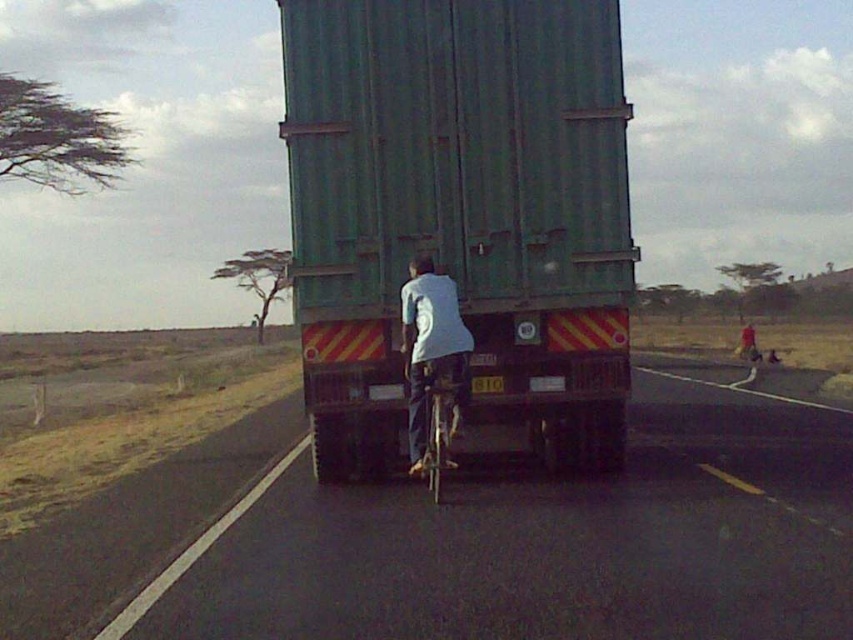
Who is shorter, green matte trailer truck at center or white matte shirt at center?

white matte shirt at center

Can you confirm if green matte trailer truck at center is wider than white matte shirt at center?

Correct, the width of green matte trailer truck at center exceeds that of white matte shirt at center.

Locate an element on the screen. The height and width of the screenshot is (640, 853). green matte trailer truck at center is located at coordinates (461, 218).

Is black asphalt road at center smaller than metallic silver bicycle at center?

Incorrect, black asphalt road at center is not smaller in size than metallic silver bicycle at center.

I want to click on black asphalt road at center, so click(x=480, y=534).

Image resolution: width=853 pixels, height=640 pixels. Describe the element at coordinates (480, 534) in the screenshot. I see `black asphalt road at center` at that location.

Identify the location of black asphalt road at center. This screenshot has width=853, height=640. (480, 534).

Can you confirm if white matte shirt at center is shorter than metallic silver bicycle at center?

Incorrect, white matte shirt at center's height does not fall short of metallic silver bicycle at center's.

Which is in front, point (402, 305) or point (440, 456)?

Point (440, 456) is in front.

The width and height of the screenshot is (853, 640). Find the location of `white matte shirt at center`. white matte shirt at center is located at coordinates (432, 352).